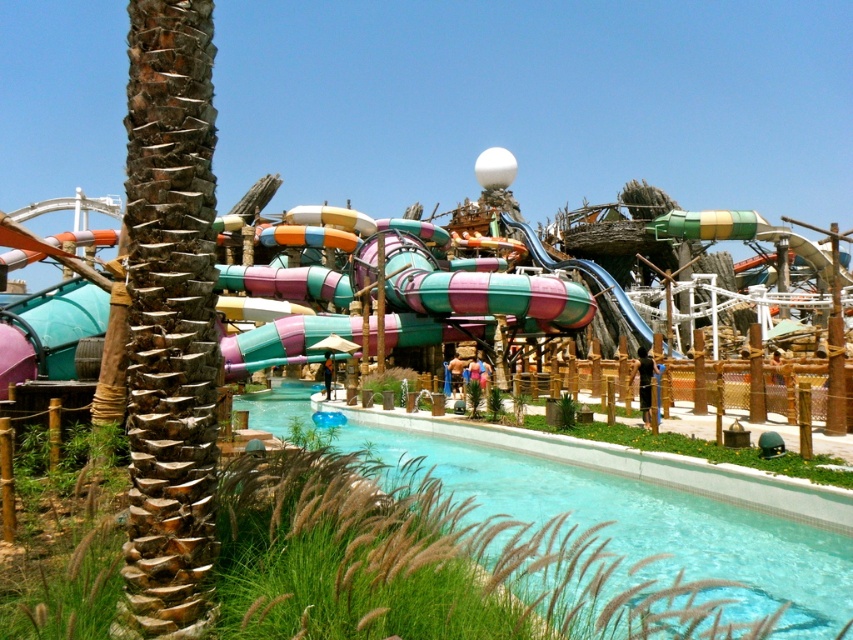
You are standing at the entrance of the water park and see two points marked in the scene. The first point is located at coordinates point [135,8], and the second is at point [659,577]. Which point is nearer to you?

Point [135,8] is closer to the viewer than point [659,577], so the first point is nearer to you.